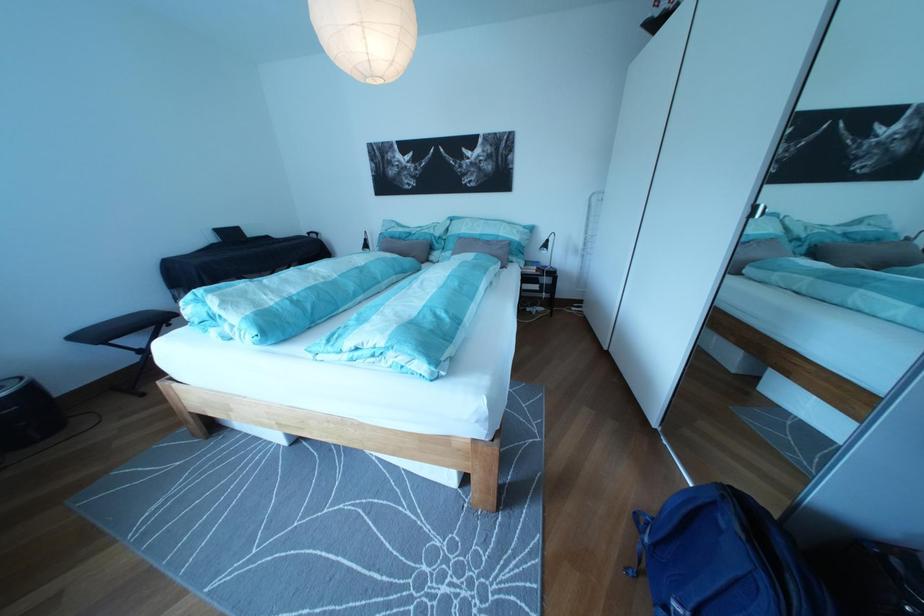
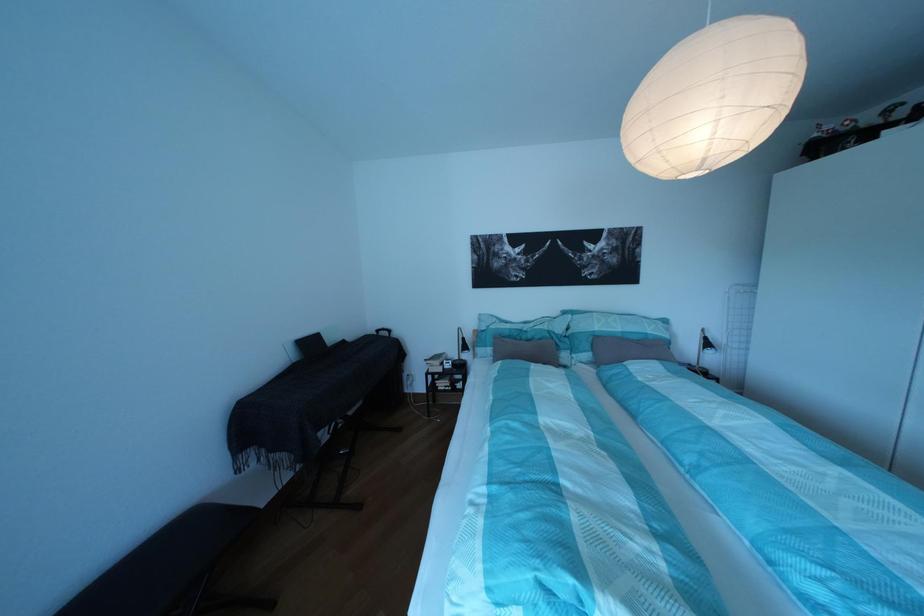
The point at (423,244) is marked in the first image. Where is the corresponding point in the second image?

(538, 342)